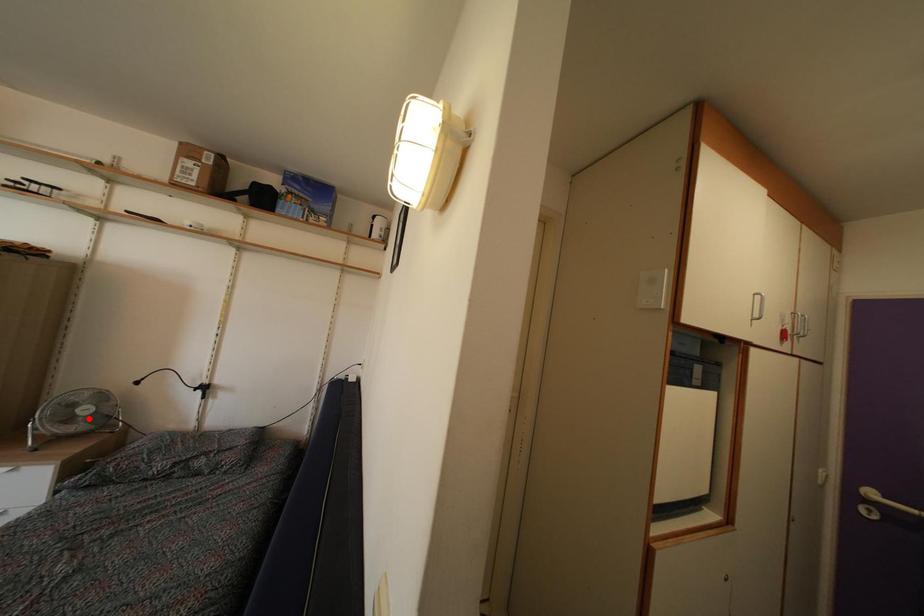
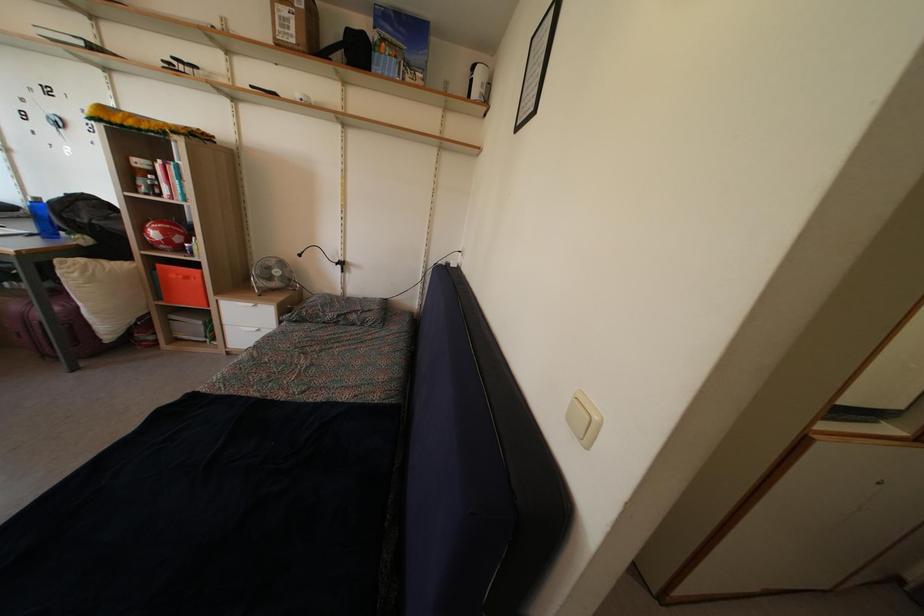
Where in the second image is the point corresponding to the highlighted location from the first image?

(280, 281)